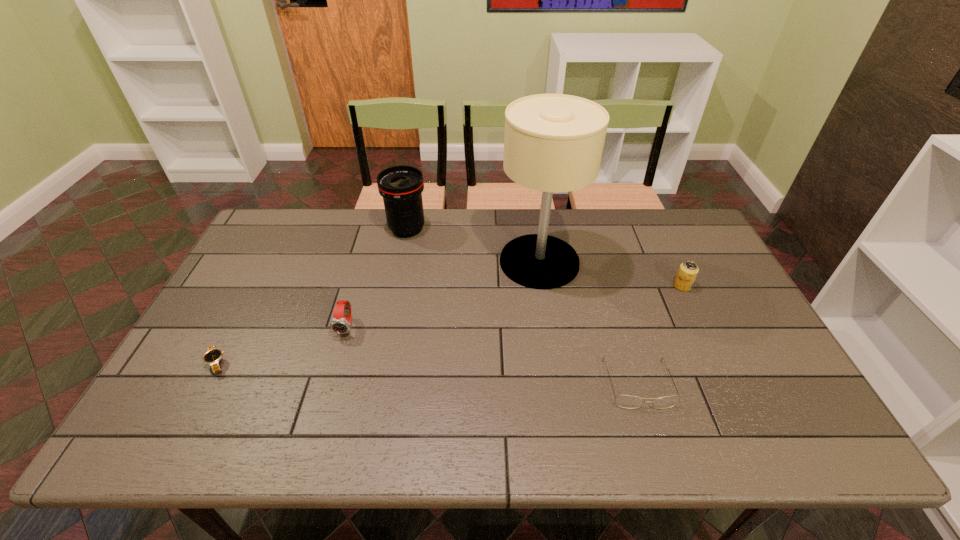
The width and height of the screenshot is (960, 540). What are the coordinates of `table lamp` in the screenshot? It's located at (553, 142).

The width and height of the screenshot is (960, 540). What are the coordinates of `telephoto lens` in the screenshot? It's located at (401, 187).

The height and width of the screenshot is (540, 960). What are the coordinates of `the third object from left to right` in the screenshot? It's located at (401, 187).

Locate an element on the screen. The width and height of the screenshot is (960, 540). the rightmost object is located at coordinates (688, 270).

Find the location of a particular element. This screenshot has width=960, height=540. the fourth farthest object is located at coordinates [340, 324].

You are a GUI agent. You are given a task and a screenshot of the screen. Output one action in this format:
    pyautogui.click(x=<x>, y=<y>)
    Task: Click on the taller watch
    
    Given the screenshot: What is the action you would take?
    pyautogui.click(x=340, y=324)

This screenshot has width=960, height=540. I want to click on spectacles, so click(624, 401).

Where is `the nearer watch`? the nearer watch is located at coordinates (213, 356).

Find the location of `the left watch`. the left watch is located at coordinates (213, 356).

Where is `vacant space located 0.390m on the front of the table lamp`? The height and width of the screenshot is (540, 960). vacant space located 0.390m on the front of the table lamp is located at coordinates (562, 407).